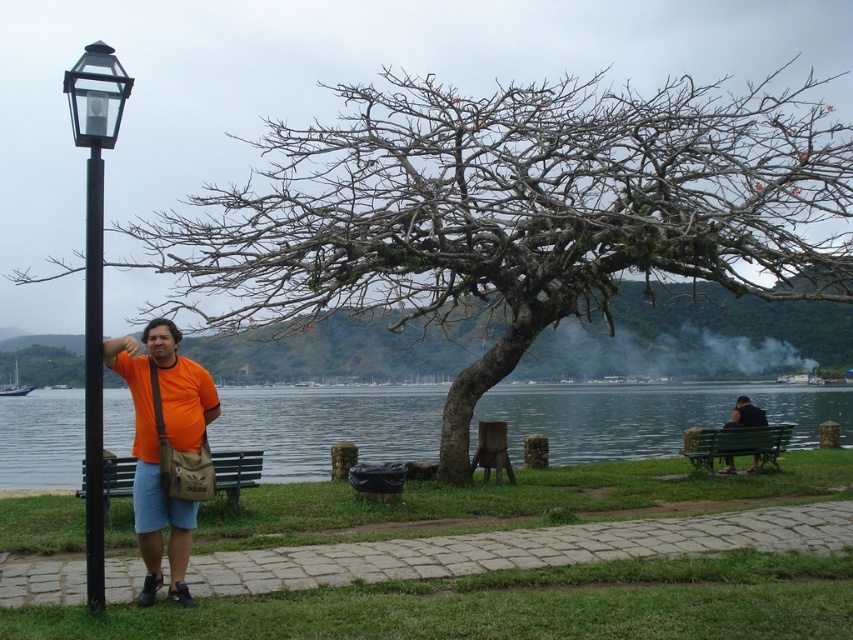
Question: Is green wooden bench at right to the left of black fabric person at right from the viewer's perspective?

Choices:
 (A) yes
 (B) no

Answer: (A)

Question: Which point is closer to the camera?

Choices:
 (A) black fabric person at right
 (B) brown leather bench at lower left
 (C) black metal lamp post at left

Answer: (C)

Question: Which point is farther to the camera?

Choices:
 (A) (265, 451)
 (B) (795, 244)

Answer: (A)

Question: Among these objects, which one is farthest from the camera?

Choices:
 (A) black metal lamp post at left
 (B) green wooden bench at right
 (C) brown leather bench at lower left

Answer: (B)

Question: Does black metal pole at left appear on the right side of brown leather bench at lower left?

Choices:
 (A) no
 (B) yes

Answer: (B)

Question: Does orange fabric shirt at left come in front of brown leather bench at lower left?

Choices:
 (A) yes
 (B) no

Answer: (A)